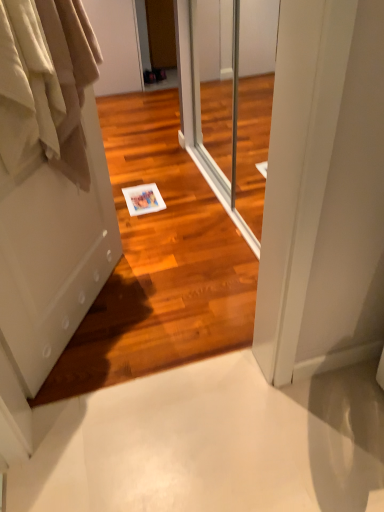
Locate an element on the screen. This screenshot has width=384, height=512. vacant area that lies between white matte door at left and transparent glass screen door at center is located at coordinates (169, 275).